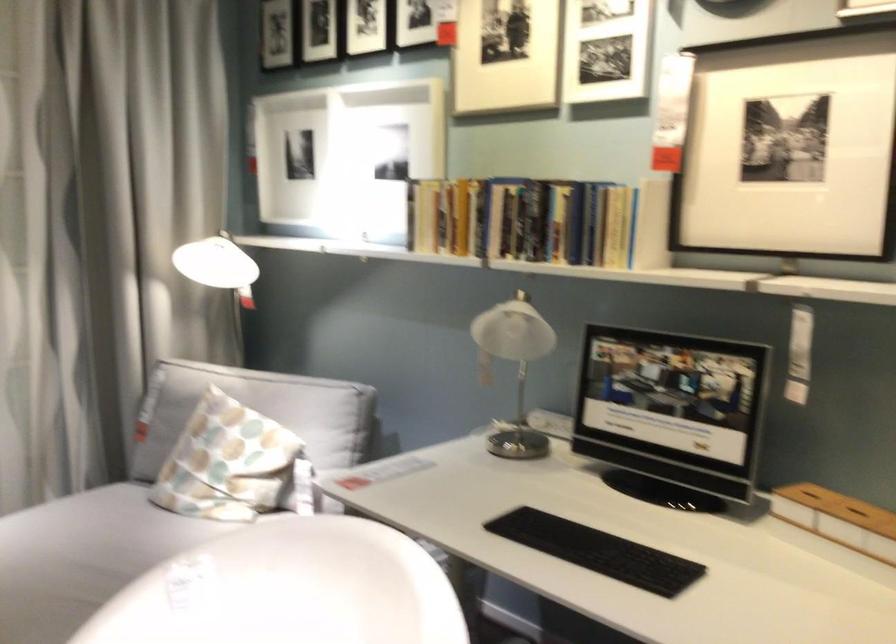
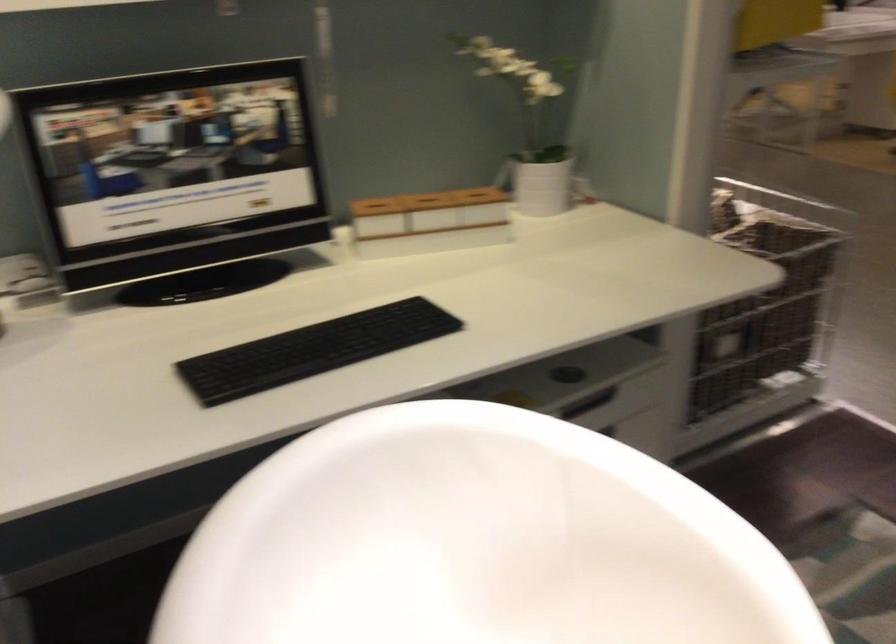
The point at [566,542] is marked in the first image. Where is the corresponding point in the second image?

(313, 350)